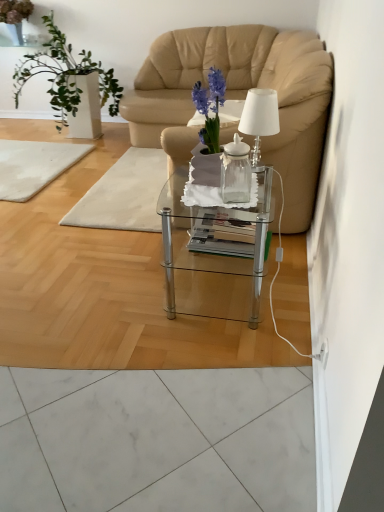
Question: Does transparent glass vase at center come behind translucent glass table at center, the 1th mat in the right-to-left sequence?

Choices:
 (A) yes
 (B) no

Answer: (B)

Question: Could you tell me if transparent glass vase at center is turned towards translucent glass table at center, the 1th mat in the right-to-left sequence?

Choices:
 (A) yes
 (B) no

Answer: (B)

Question: Does transparent glass vase at center have a greater height compared to translucent glass table at center, the 1th mat in the right-to-left sequence?

Choices:
 (A) yes
 (B) no

Answer: (A)

Question: Considering the relative sizes of transparent glass vase at center and translucent glass table at center, acting as the 2th mat starting from the left, in the image provided, is transparent glass vase at center shorter than translucent glass table at center, acting as the 2th mat starting from the left,?

Choices:
 (A) no
 (B) yes

Answer: (A)

Question: Does transparent glass vase at center have a smaller size compared to translucent glass table at center, acting as the 2th mat starting from the left?

Choices:
 (A) no
 (B) yes

Answer: (B)

Question: Is point (145, 219) positioned closer to the camera than point (225, 146)?

Choices:
 (A) farther
 (B) closer

Answer: (A)

Question: Is translucent glass table at center, the 1th mat in the right-to-left sequence, in front of or behind transparent glass vase at center in the image?

Choices:
 (A) front
 (B) behind

Answer: (B)

Question: Would you say translucent glass table at center, the 1th mat in the right-to-left sequence, is to the left or to the right of transparent glass vase at center in the picture?

Choices:
 (A) left
 (B) right

Answer: (A)

Question: Is translucent glass table at center, the 1th mat in the right-to-left sequence, bigger or smaller than transparent glass vase at center?

Choices:
 (A) big
 (B) small

Answer: (A)

Question: Is point (264, 126) positioned closer to the camera than point (57, 98)?

Choices:
 (A) farther
 (B) closer

Answer: (B)

Question: In the image, is white glass table lamp at upper right on the left side or the right side of white glossy vase at left?

Choices:
 (A) right
 (B) left

Answer: (A)

Question: Looking at their shapes, would you say white glass table lamp at upper right is wider or thinner than white glossy vase at left?

Choices:
 (A) thin
 (B) wide

Answer: (A)

Question: In terms of size, does white glass table lamp at upper right appear bigger or smaller than white glossy vase at left?

Choices:
 (A) small
 (B) big

Answer: (A)

Question: From their relative heights in the image, would you say translucent glass table at center, the 1th mat in the right-to-left sequence, is taller or shorter than clear glass coffee table at center?

Choices:
 (A) tall
 (B) short

Answer: (B)

Question: Is translucent glass table at center, the 1th mat in the right-to-left sequence, inside the boundaries of clear glass coffee table at center, or outside?

Choices:
 (A) inside
 (B) outside

Answer: (B)